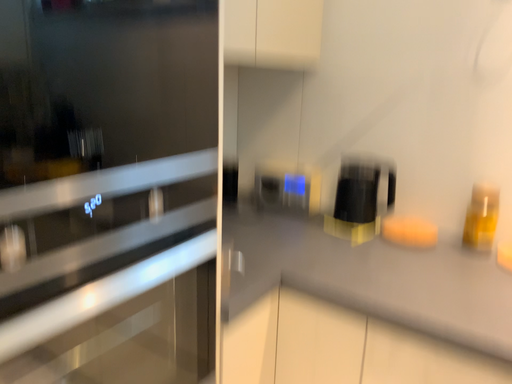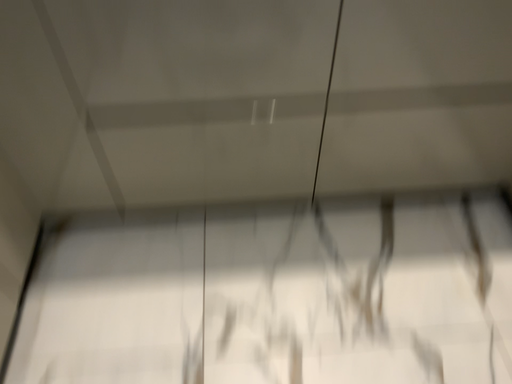
Question: Which way did the camera rotate in the video?

Choices:
 (A) rotated left
 (B) rotated right

Answer: (B)